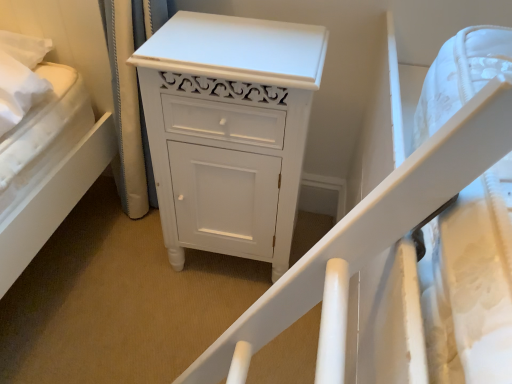
The height and width of the screenshot is (384, 512). What do you see at coordinates (229, 130) in the screenshot? I see `white painted wood cabinet at center` at bounding box center [229, 130].

Locate an element on the screen. white painted wood cabinet at center is located at coordinates (229, 130).

Where is `white painted wood cabinet at center`? The height and width of the screenshot is (384, 512). white painted wood cabinet at center is located at coordinates (229, 130).